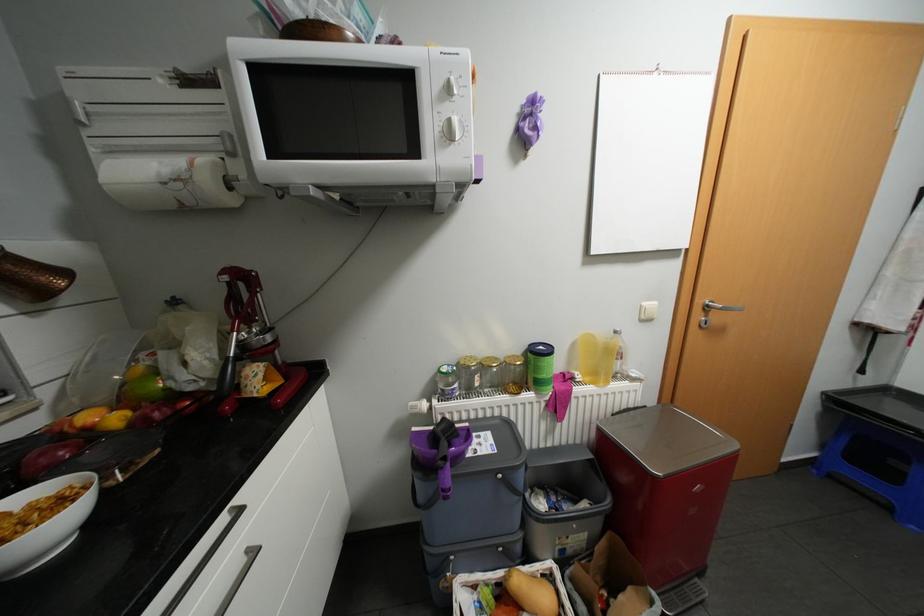
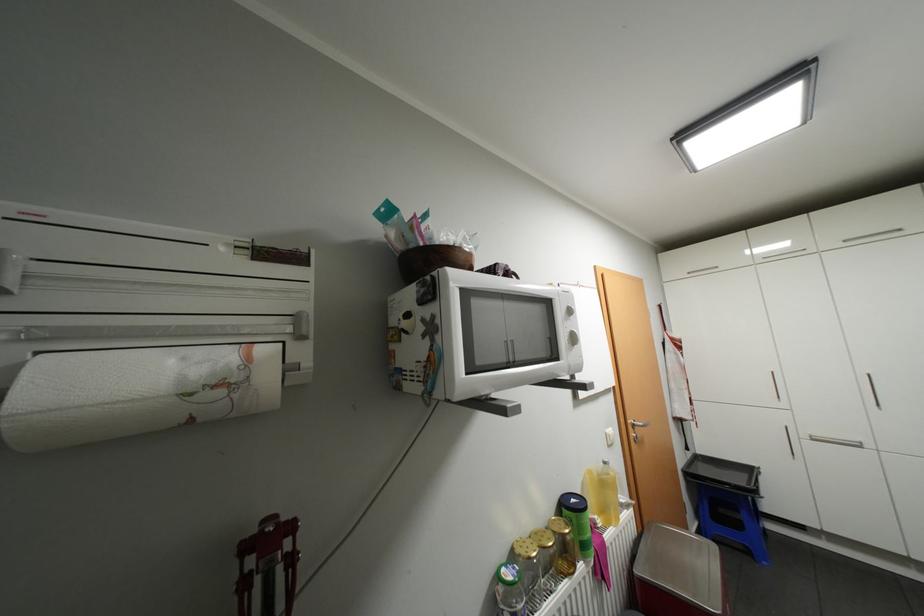
Locate, in the second image, the point that corresponds to (199,164) in the first image.

(256, 358)